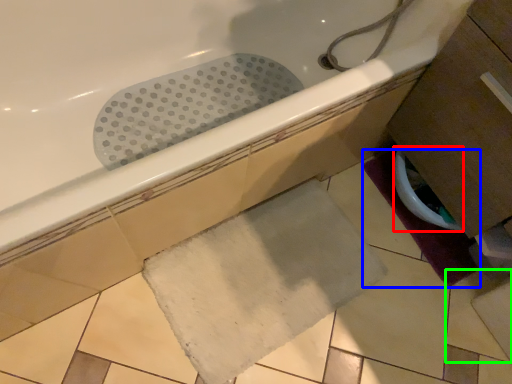
Question: Which is nearer to the toilet bowl (highlighted by a red box)? bath mat (highlighted by a blue box) or ceramic tile (highlighted by a green box).

Choices:
 (A) bath mat
 (B) ceramic tile

Answer: (A)